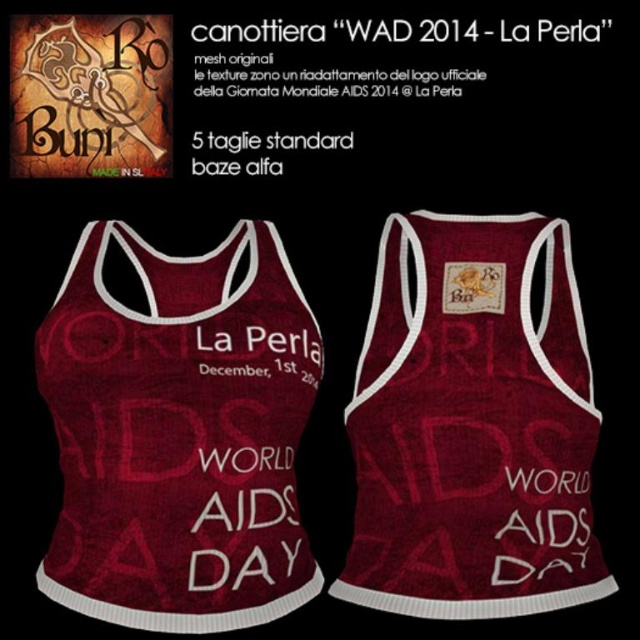
Does burgundy knitted tank top at center have a lesser width compared to matte maroon tank top at center?

Yes.

Based on the photo, measure the distance between point (406, 333) and camera.

Point (406, 333) is 1.32 meters away from camera.

At what (x,y) coordinates should I click in order to perform the action: click on burgundy knitted tank top at center. Please return your answer as a coordinate pair (x, y). This screenshot has width=640, height=640. Looking at the image, I should click on (472, 426).

From the picture: Does burgundy textured tank top at center have a smaller size compared to burgundy knitted tank top at center?

Actually, burgundy textured tank top at center might be larger than burgundy knitted tank top at center.

The height and width of the screenshot is (640, 640). Describe the element at coordinates (179, 435) in the screenshot. I see `burgundy textured tank top at center` at that location.

Between point (296, 554) and point (528, 444), which one is positioned in front?

Point (528, 444) is more forward.

Identify the location of burgundy textured tank top at center. The height and width of the screenshot is (640, 640). (179, 435).

Does burgundy textured tank top at center have a lesser width compared to matte maroon tank top at center?

Correct, burgundy textured tank top at center's width is less than matte maroon tank top at center's.

Which is above, burgundy textured tank top at center or matte maroon tank top at center?

matte maroon tank top at center is higher up.

Does point (228, 611) come closer to viewer compared to point (216, 67)?

That is True.

The height and width of the screenshot is (640, 640). I want to click on burgundy textured tank top at center, so click(x=179, y=435).